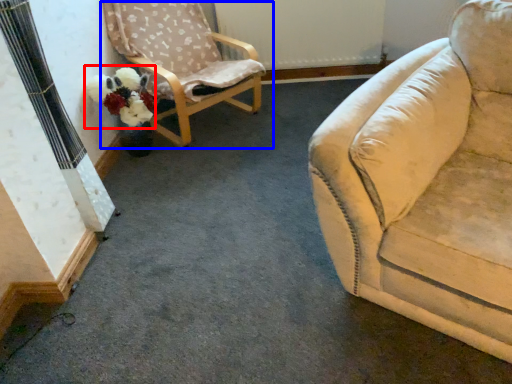
Question: Among these objects, which one is farthest to the camera, flower (highlighted by a red box) or chair (highlighted by a blue box)?

Choices:
 (A) flower
 (B) chair

Answer: (A)